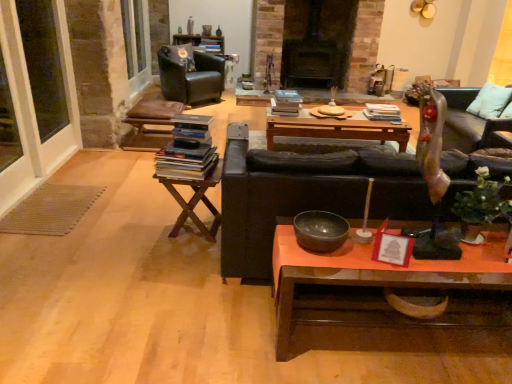
This screenshot has height=384, width=512. What are the coordinates of `vacant area situated below hardcover book at center, marked as the first book in a right-to-left arrangement (from a real-world perspective)` in the screenshot? It's located at (379, 119).